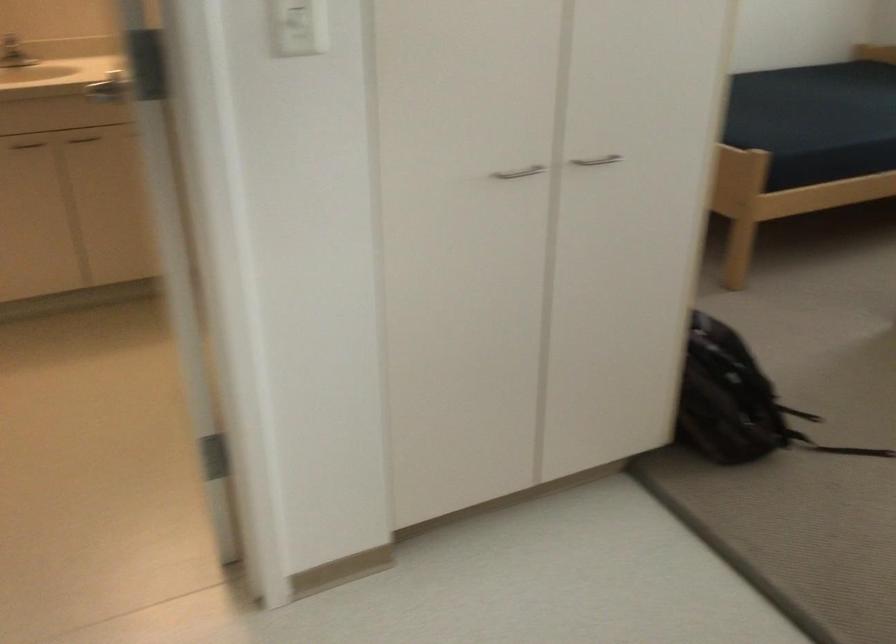
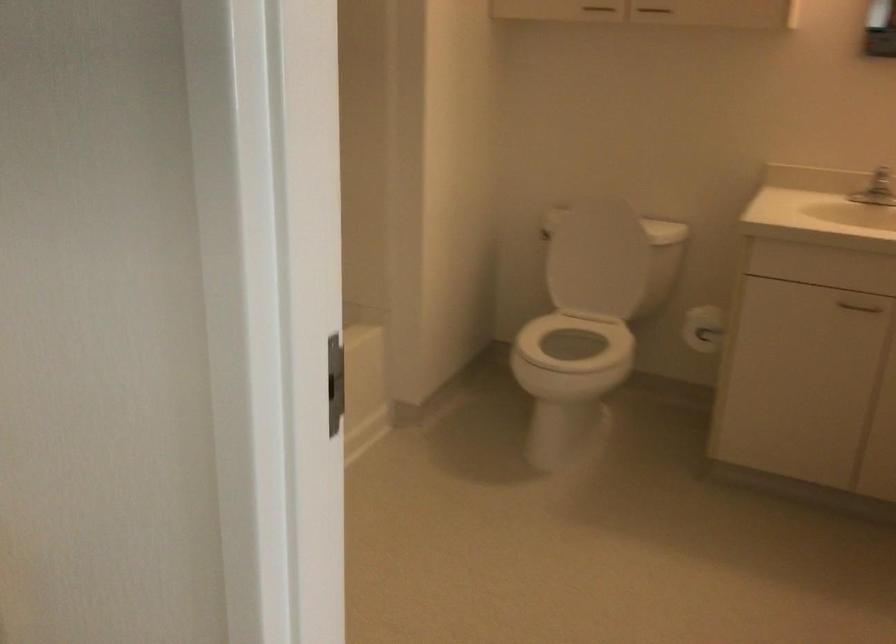
Question: Based on the continuous images, in which direction is the camera rotating? Reply with the corresponding letter.

Choices:
 (A) Left
 (B) Right
 (C) Up
 (D) Down

Answer: (A)